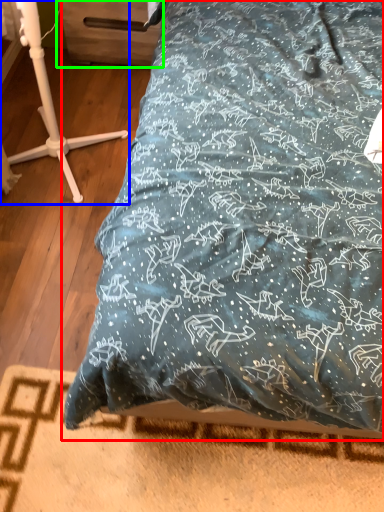
Question: Which is nearer to the bed (highlighted by a red box)? furniture (highlighted by a blue box) or drawer (highlighted by a green box).

Choices:
 (A) furniture
 (B) drawer

Answer: (A)